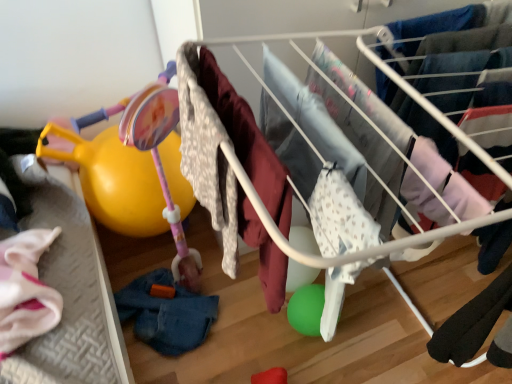
Where is `vacant region under white fabric baby clothes at center (from a real-world perspective)`? vacant region under white fabric baby clothes at center (from a real-world perspective) is located at coordinates (350, 357).